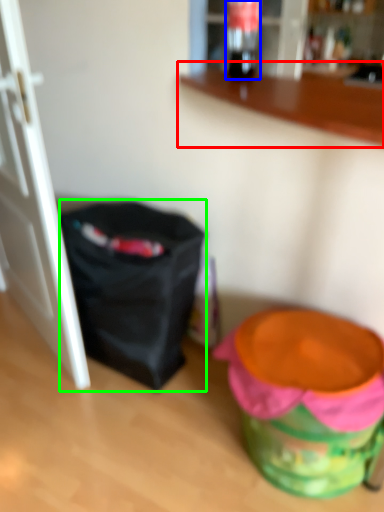
Question: Which is farther away from counter (highlighted by a red box)? beverage (highlighted by a blue box) or bag (highlighted by a green box)?

Choices:
 (A) beverage
 (B) bag

Answer: (A)